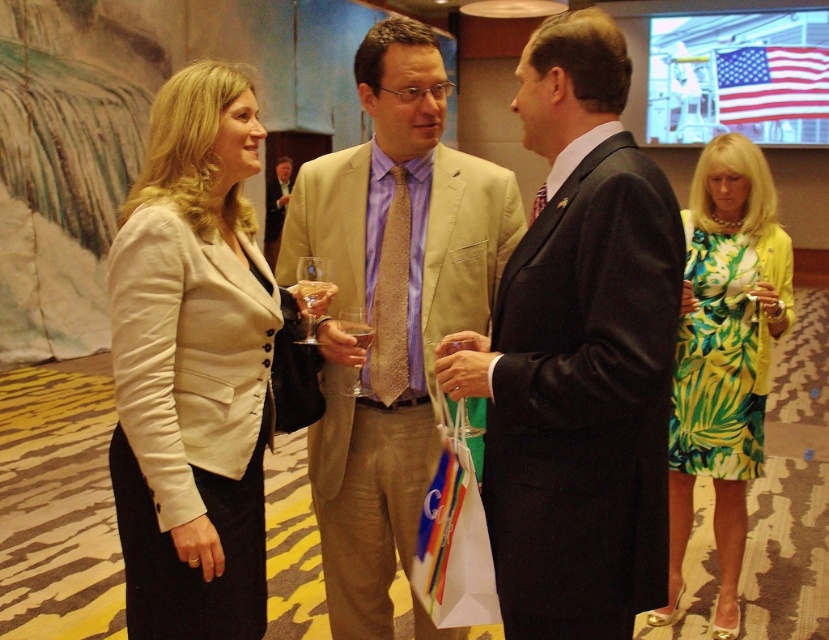
Question: Which object is the closest to the matte beige blazer at center?

Choices:
 (A) translucent glass wine glass at center
 (B) satin gold tie at center

Answer: (A)

Question: Which point is farther to the camera?

Choices:
 (A) light beige suit at center
 (B) translucent glass wine glass at center

Answer: (B)

Question: Is satin gold tie at center smaller than translucent glass wine glass at center?

Choices:
 (A) yes
 (B) no

Answer: (B)

Question: Is matte beige blazer at center to the left of green leafy dress at right from the viewer's perspective?

Choices:
 (A) yes
 (B) no

Answer: (A)

Question: Is dark suit at center closer to camera compared to clear glass wine glass at center?

Choices:
 (A) yes
 (B) no

Answer: (A)

Question: Which object is the closest to the translucent glass wine glass at center?

Choices:
 (A) satin gold tie at center
 (B) clear glass wine glass at center

Answer: (B)